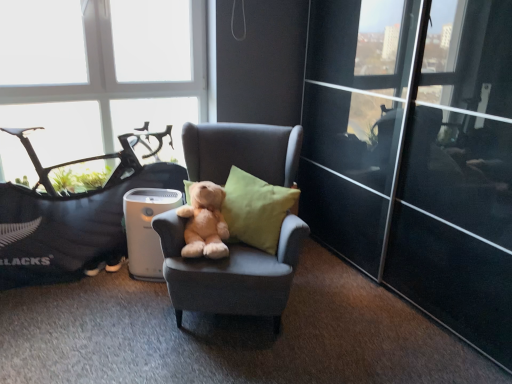
Find the location of a particular element. vacant space that is to the left of matte gray armchair at center is located at coordinates (95, 318).